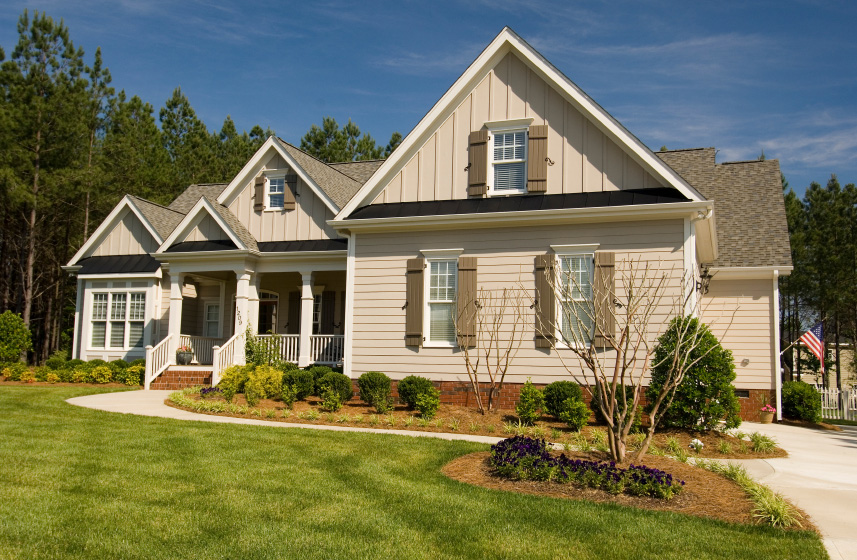
I want to click on window shutters, so click(x=261, y=194), click(x=288, y=194), click(x=478, y=170), click(x=538, y=161), click(x=542, y=311), click(x=609, y=263), click(x=470, y=277), click(x=417, y=294).